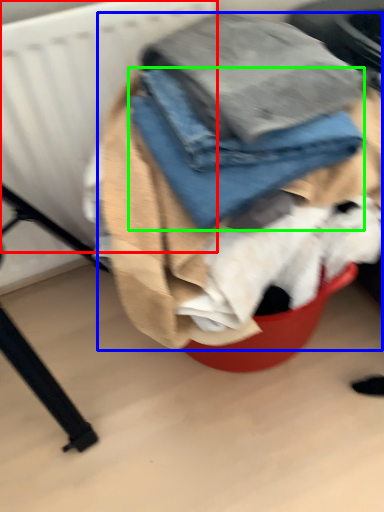
Question: Estimate the real-world distances between objects in this image. Which object is farther from radiator (highlighted by a red box), laundry (highlighted by a blue box) or trousers (highlighted by a green box)?

Choices:
 (A) laundry
 (B) trousers

Answer: (B)